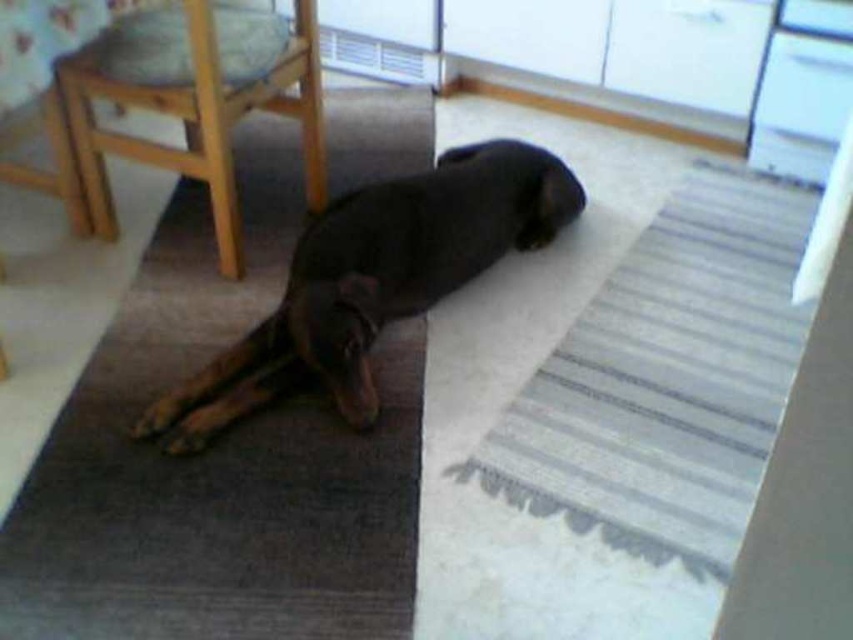
From the picture: You are a pet owner who wants to place a new dog bed on the floor. The dog bed is the same size as the striped fabric mat at center. Will the black glossy dog at center fit comfortably on the dog bed?

The striped fabric mat at center is larger in size than black glossy dog at center. Since the dog bed is the same size as the mat, the black glossy dog at center will fit comfortably on the dog bed.

You are standing at the point marked as point [668,378]. What object are you standing on?

You are standing on the striped fabric mat at center.

You are standing in the room and want to place a small potted plant exactly where the striped fabric mat at center is located. What are the coordinates where you should place the plant?

The coordinates for the striped fabric mat at center are at point (668, 378), so place the plant there.